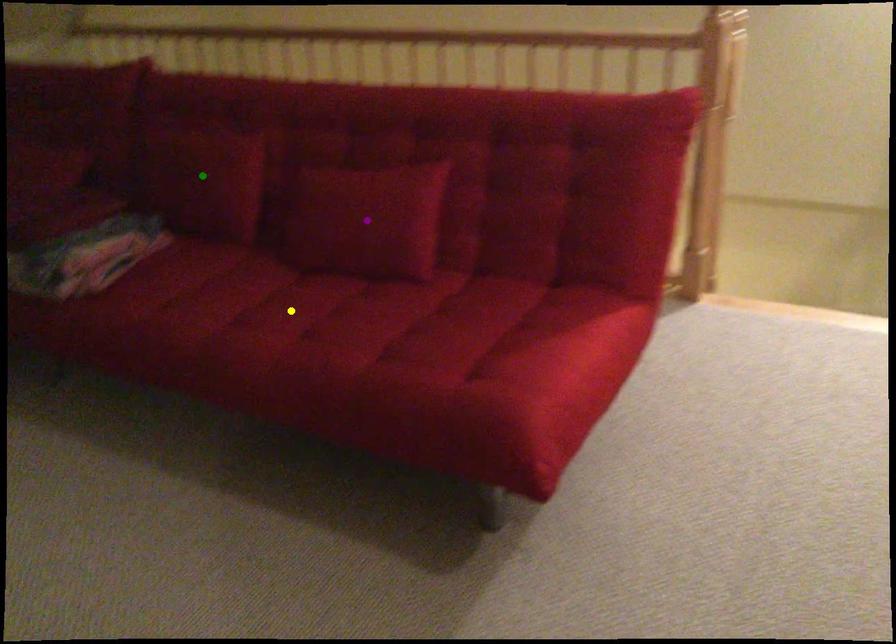
Order these from farthest to nearest:
green point | yellow point | purple point

green point < purple point < yellow point